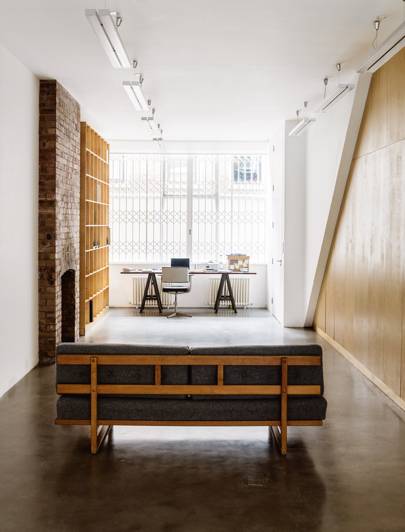
Locate an element on the screen. Image resolution: width=405 pixels, height=532 pixels. sofa is located at coordinates (177, 410).